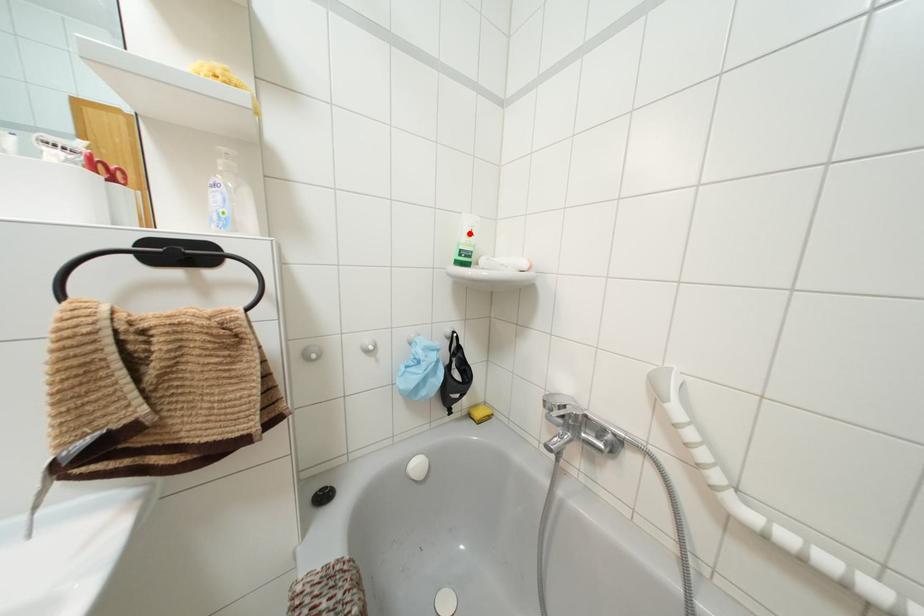
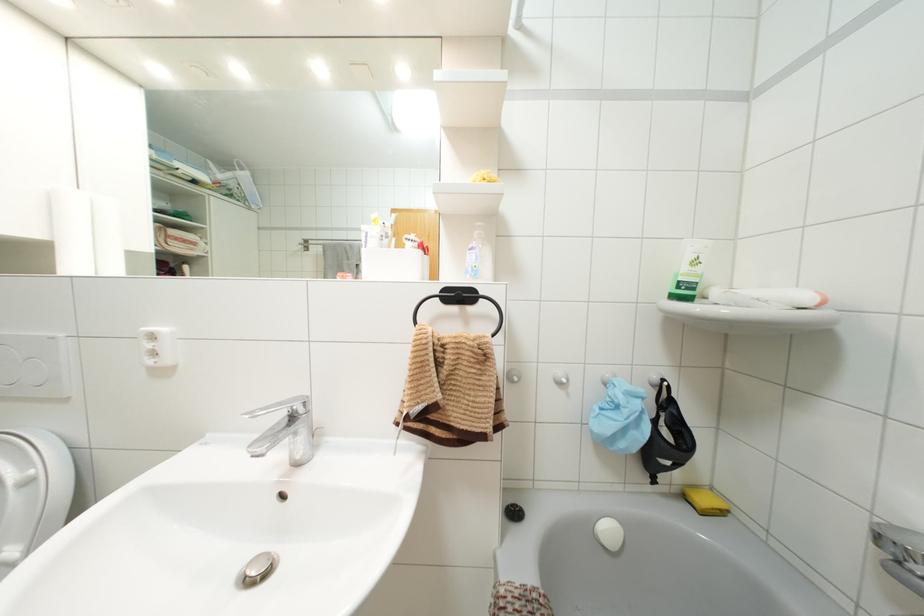
Locate, in the second image, the point that corresponds to the highlighted location in the first image.

(695, 262)